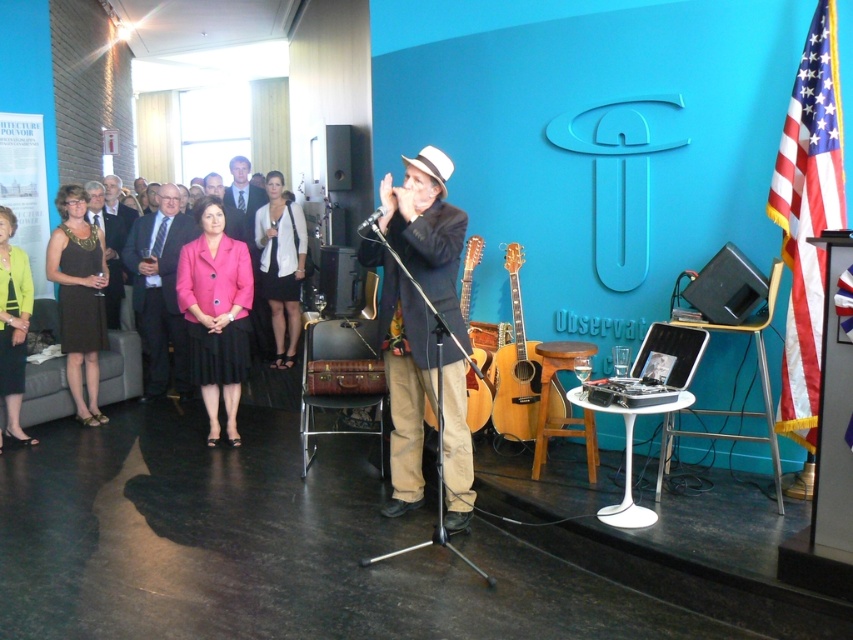
You are a photographer trying to capture the man playing the harmonica on the stage. You notice a point at coordinates (79, 296). Where exactly is this point located in relation to the man and the dark brown dress at left?

The point at coordinates (79, 296) is located on the dark brown dress at left, which is positioned to the left side of the man playing the harmonica.

You are an event planner trying to set up a spotlight for the performer. The spotlight can only be placed at coordinates between 0.3 and 0.4 on the x and y axes. Can the spotlight be positioned to focus on the white matte blazer at center?

The white matte blazer at center is located at point 0.414 on the x and 0.331 on the y. Since the spotlight requires coordinates between 0.3 and 0.4 on both axes, the x coordinate of 0.414 exceeds the maximum limit of 0.4. Therefore, the spotlight cannot be positioned to focus on the white matte blazer at center.

You are an event planner organizing a stage setup. You need to place a pink fabric skirt at center. According to the image, where exactly should you position it?

The pink fabric skirt at center should be positioned at point 0.491 on the x axis and 0.254 on the y axis as specified in the description.